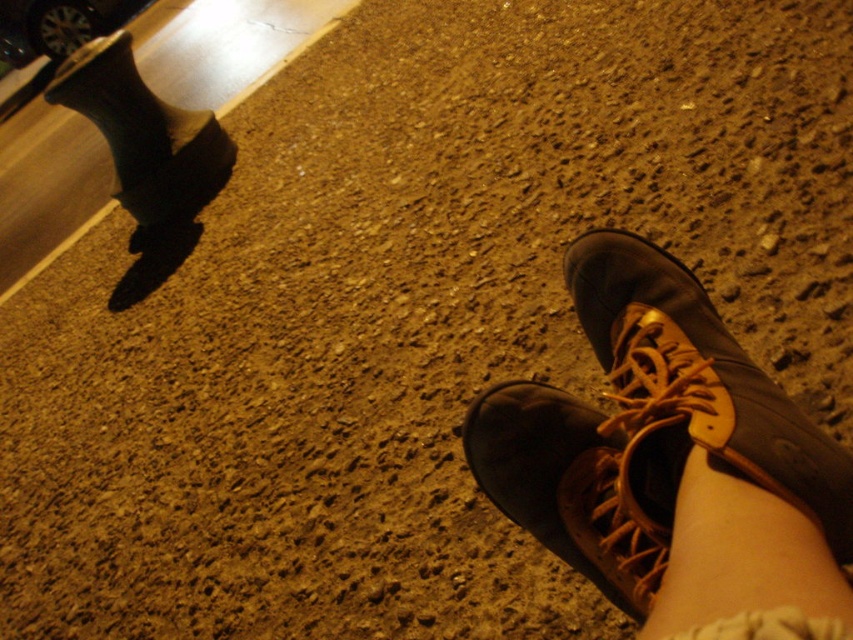
You are standing on the gravel path and want to place a small item between the brown leather boot at lower right and the leather at lower right. Is there enough space for it?

The distance between the brown leather boot at lower right and the leather at lower right is 17.91 inches, so there is sufficient space to place a small item between them.

You are standing on the gravel path and see the brown leather boot at lower right and the leather at lower right. Which object is wider?

The brown leather boot at lower right is wider than the leather at lower right.

You are standing in a dark parking lot and see the brown leather boot at lower right and the shiny chrome car at upper left. Which object appears closer to you based on their sizes in the image?

The brown leather boot at lower right appears closer because it has a smaller size compared to the shiny chrome car at upper left, which is farther away.